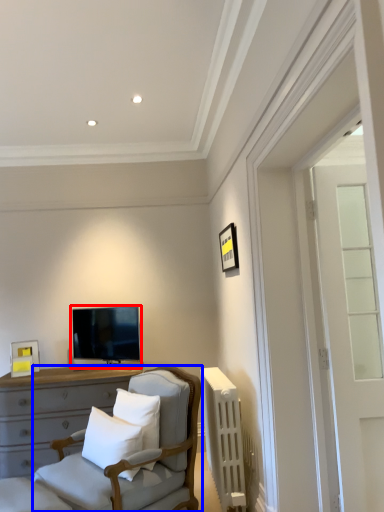
Question: Which point is closer to the camera, television (highlighted by a red box) or chair (highlighted by a blue box)?

Choices:
 (A) television
 (B) chair

Answer: (B)